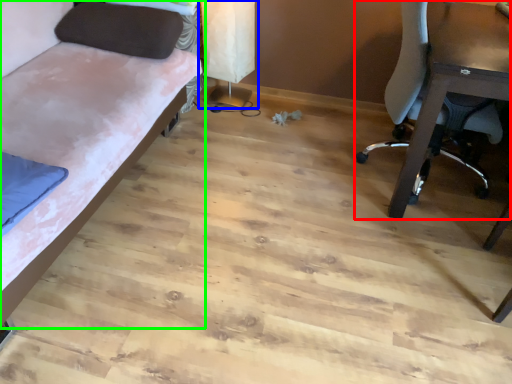
Question: Based on their relative distances, which object is farther from chair (highlighted by a red box)? Choose from table lamp (highlighted by a blue box) and studio couch (highlighted by a green box).

Choices:
 (A) table lamp
 (B) studio couch

Answer: (B)